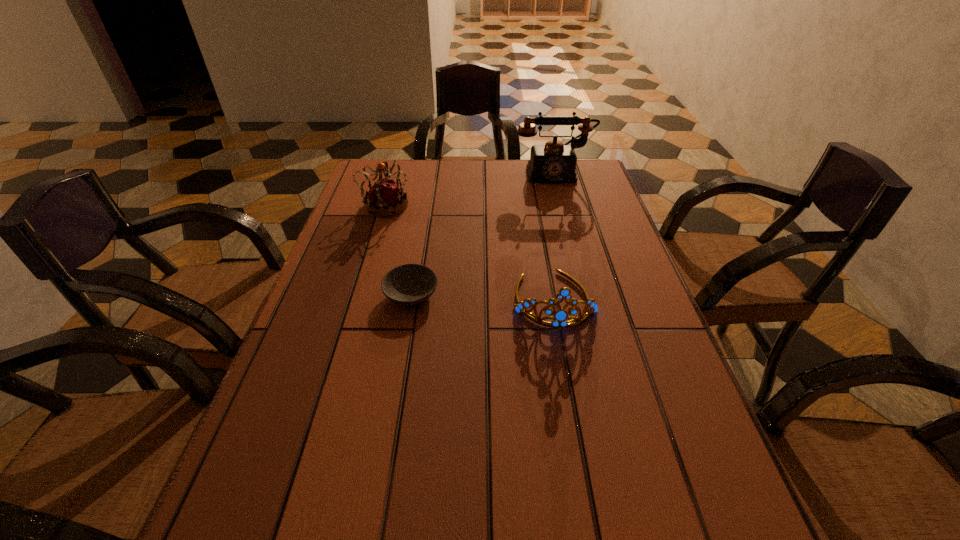
This screenshot has height=540, width=960. I want to click on vacant space at the right edge of the desktop, so click(642, 329).

Image resolution: width=960 pixels, height=540 pixels. I want to click on vacant space at the far right corner of the desktop, so click(577, 164).

You are a GUI agent. You are given a task and a screenshot of the screen. Output one action in this format:
    pyautogui.click(x=<x>, y=<y>)
    Task: Click on the free point between the nearer tiara and the bowl
    The image size is (960, 540).
    Given the screenshot: What is the action you would take?
    pyautogui.click(x=483, y=296)

You are a GUI agent. You are given a task and a screenshot of the screen. Output one action in this format:
    pyautogui.click(x=<x>, y=<y>)
    Task: Click on the free space that is in between the telephone and the right tiara
    The height and width of the screenshot is (540, 960).
    Given the screenshot: What is the action you would take?
    pyautogui.click(x=554, y=236)

Image resolution: width=960 pixels, height=540 pixels. Identify the location of free space between the second tallest object and the shortest object. (397, 250).

Find the location of a particular element. The height and width of the screenshot is (540, 960). vacant space that is in between the taller tiara and the farthest object is located at coordinates (468, 189).

Where is `free space between the bowl and the third shortest object`? This screenshot has height=540, width=960. free space between the bowl and the third shortest object is located at coordinates (397, 250).

I want to click on free space between the taller tiara and the bowl, so click(x=397, y=250).

Locate an element on the screen. object that stands as the second closest to the telephone is located at coordinates 559,318.

Locate which object ranks second in proximity to the bowl. Please provide its 2D coordinates. Your answer should be formatted as a tuple, i.e. [(x, y)], where the tuple contains the x and y coordinates of a point satisfying the conditions above.

[(384, 197)]